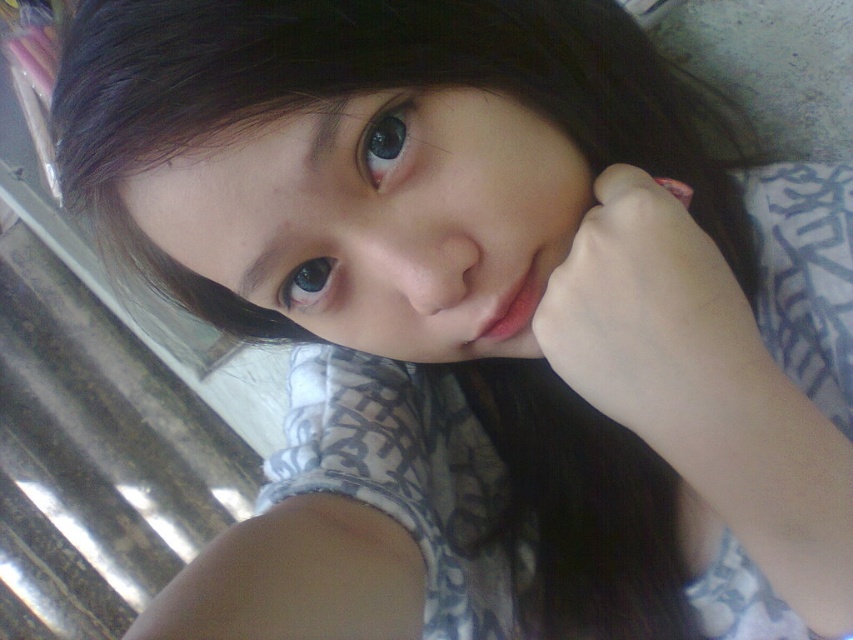
Between pale skin/hair at cheek and blue glossy eye at center, which one appears on the left side from the viewer's perspective?

From the viewer's perspective, blue glossy eye at center appears more on the left side.

Between pale skin/hair at cheek and blue glossy eye at center, which one appears on the right side from the viewer's perspective?

pale skin/hair at cheek is more to the right.

Does point (737, 378) lie in front of point (289, 289)?

Yes, point (737, 378) is in front of point (289, 289).

The width and height of the screenshot is (853, 640). I want to click on pale skin/hair at cheek, so click(x=653, y=320).

Between point (521, 349) and point (383, 157), which one is positioned in front?

Point (383, 157) is in front.

Does pink matte lips at center have a larger size compared to blue glossy eye at upper center?

Indeed, pink matte lips at center has a larger size compared to blue glossy eye at upper center.

Is point (525, 300) farther from camera compared to point (376, 161)?

Yes, it is.

Where is `pink matte lips at center`? pink matte lips at center is located at coordinates (514, 316).

From the picture: Can you confirm if blue glossy eye at upper center is thinner than blue glossy eye at center?

Correct, blue glossy eye at upper center's width is less than blue glossy eye at center's.

Does blue glossy eye at upper center have a greater height compared to blue glossy eye at center?

Indeed, blue glossy eye at upper center has a greater height compared to blue glossy eye at center.

Locate an element on the screen. Image resolution: width=853 pixels, height=640 pixels. blue glossy eye at upper center is located at coordinates (386, 138).

You are a GUI agent. You are given a task and a screenshot of the screen. Output one action in this format:
    pyautogui.click(x=<x>, y=<y>)
    Task: Click on the blue glossy eye at upper center
    
    Given the screenshot: What is the action you would take?
    pyautogui.click(x=386, y=138)